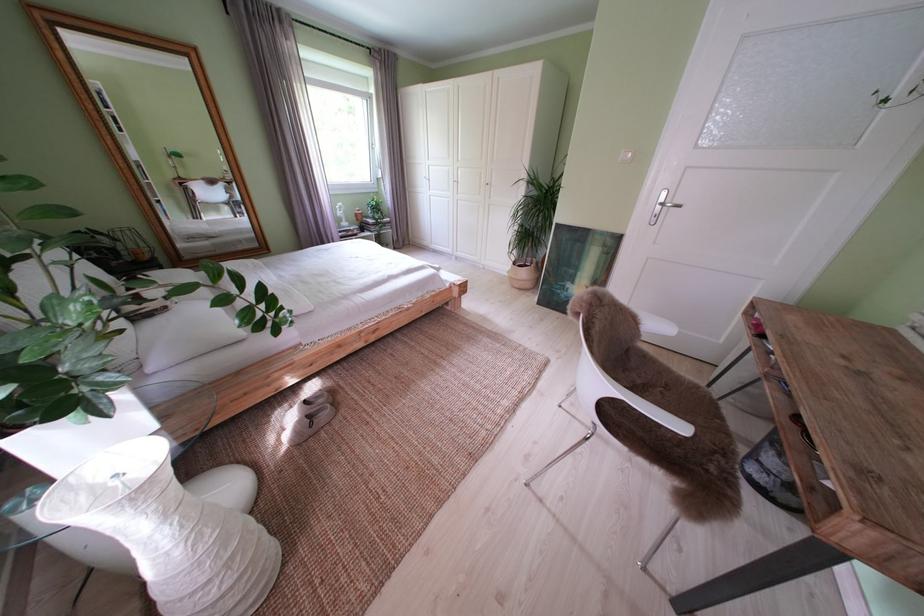
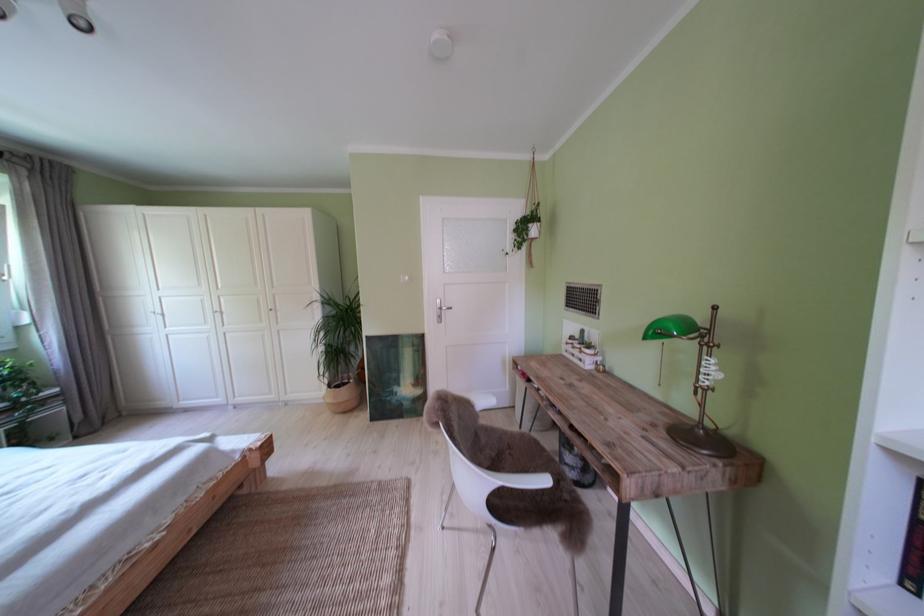
Where in the second image is the point corresponding to pixel 675 199 from the first image?

(450, 307)